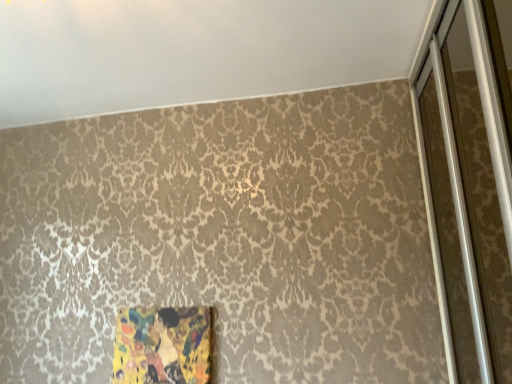
What are the coordinates of `wooden frame at lower left` in the screenshot? It's located at (162, 345).

What do you see at coordinates (162, 345) in the screenshot?
I see `wooden frame at lower left` at bounding box center [162, 345].

I want to click on wooden frame at lower left, so click(162, 345).